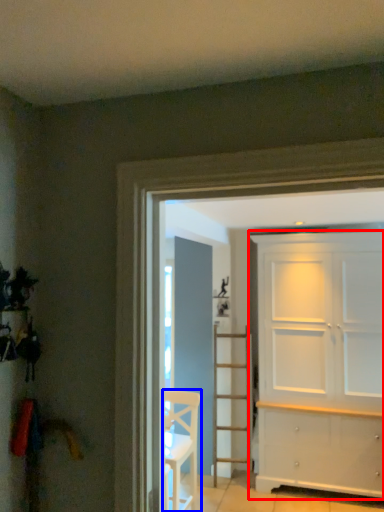
Question: Among these objects, which one is farthest to the camera, door (highlighted by a red box) or chair (highlighted by a blue box)?

Choices:
 (A) door
 (B) chair

Answer: (A)